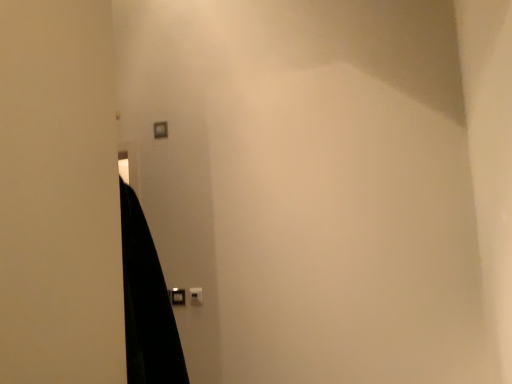
Question: From a real-world perspective, is white plastic light switch at center, which appears as the first light switch when ordered from the bottom, physically located above or below matte plastic light switch at upper center, arranged as the first light switch when viewed from the back?

Choices:
 (A) below
 (B) above

Answer: (A)

Question: From the image's perspective, relative to matte plastic light switch at upper center, placed as the first light switch when sorted from left to right, is white plastic light switch at center, the 2th light switch when ordered from left to right, above or below?

Choices:
 (A) above
 (B) below

Answer: (B)

Question: Which object is the closest to the matte plastic light switch at upper center, arranged as the second light switch when ordered from the bottom?

Choices:
 (A) black plastic door handle at lower center
 (B) white plastic light switch at center, arranged as the 1th light switch when viewed from the front

Answer: (A)

Question: Estimate the real-world distances between objects in this image. Which object is farther from the matte plastic light switch at upper center, arranged as the first light switch when viewed from the back?

Choices:
 (A) white plastic light switch at center, the 2th light switch when ordered from left to right
 (B) black plastic door handle at lower center

Answer: (A)